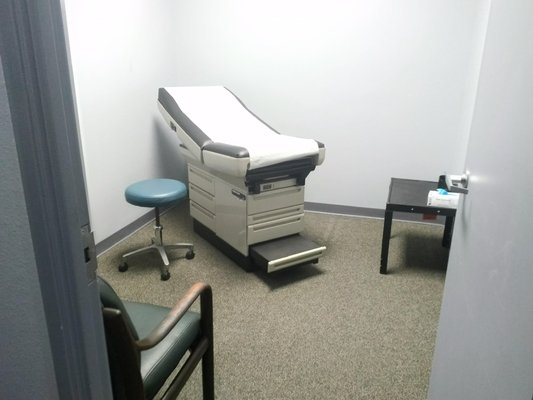
Identify the location of black table for corner of the room. The width and height of the screenshot is (533, 400). (408, 199).